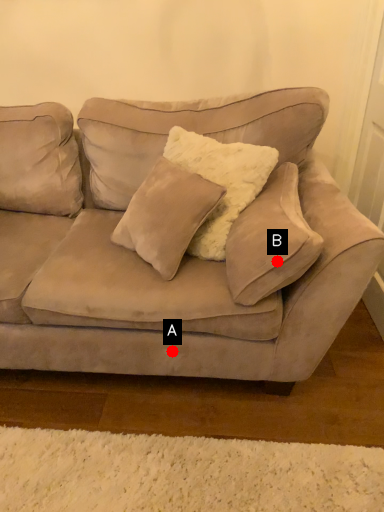
Question: Two points are circled on the image, labeled by A and B beside each circle. Which point is farther from the camera taking this photo?

Choices:
 (A) A is further
 (B) B is further

Answer: (A)